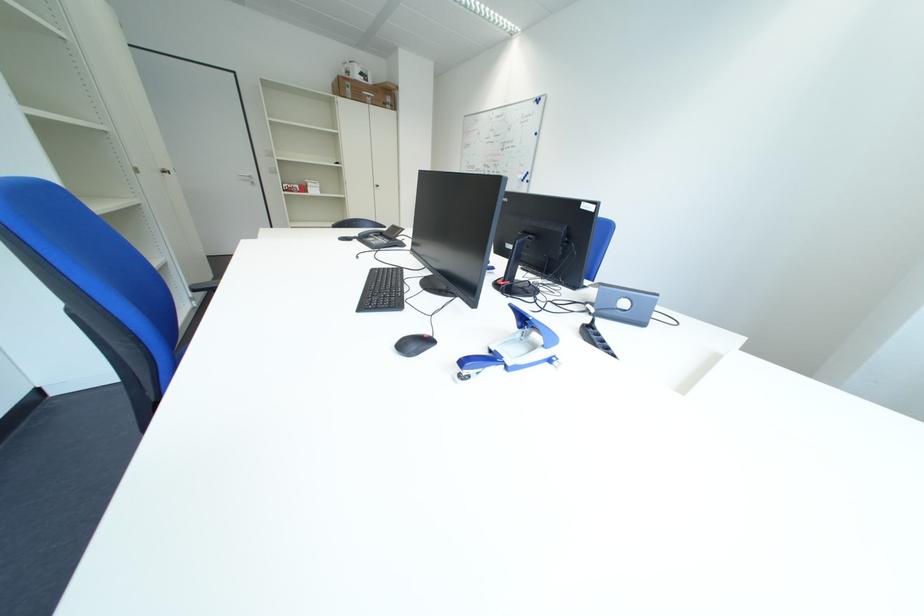
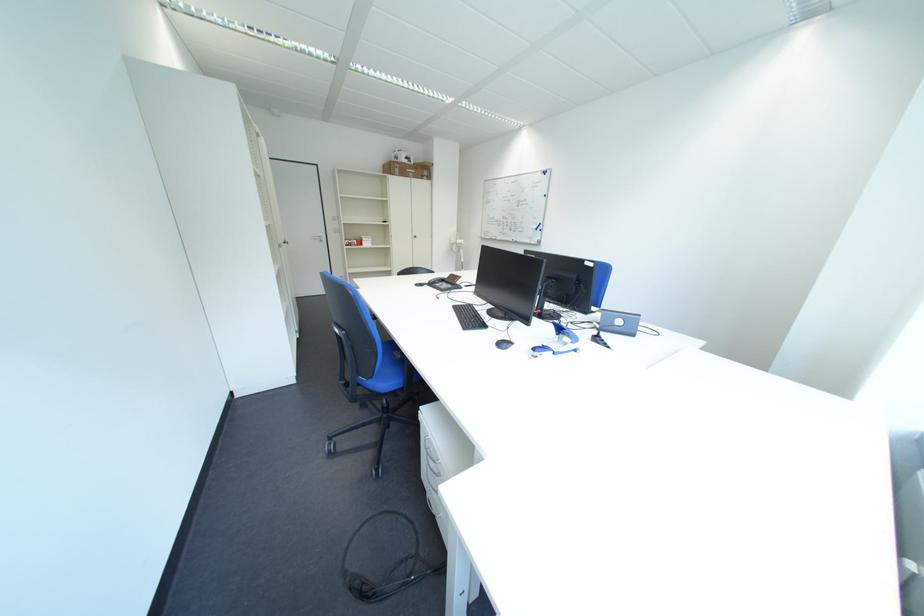
Question: Based on the continuous images, in which direction is the camera rotating? Reply with the corresponding letter.

Choices:
 (A) Left
 (B) Right
 (C) Up
 (D) Down

Answer: (C)